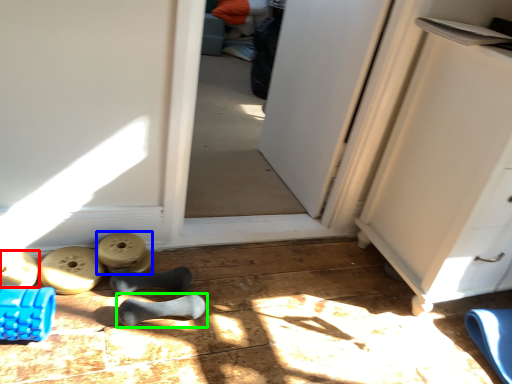
Question: Based on their relative distances, which object is nearer to footwear (highlighted by a red box)? Choose from job (highlighted by a blue box) and footwear (highlighted by a green box).

Choices:
 (A) job
 (B) footwear

Answer: (A)